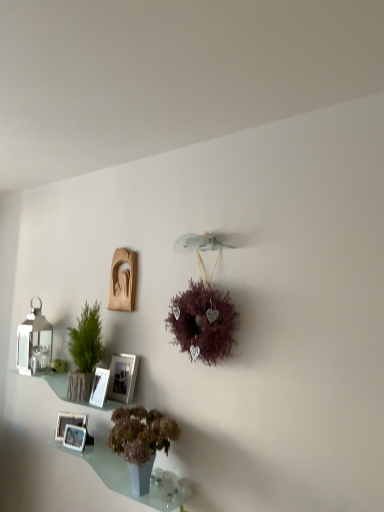
Question: Is white glossy picture frame at lower left, arranged as the 3th picture frame when ordered from the bottom, facing towards translucent glass shelf at lower center, which appears as the 2th window sill when viewed from the top?

Choices:
 (A) no
 (B) yes

Answer: (A)

Question: Does white glossy picture frame at lower left, marked as the 3th picture frame in a top-to-bottom arrangement, have a lesser height compared to translucent glass shelf at lower center, which is the 1th window sill in bottom-to-top order?

Choices:
 (A) yes
 (B) no

Answer: (B)

Question: Considering the relative sizes of white glossy picture frame at lower left, arranged as the 3th picture frame when ordered from the bottom, and translucent glass shelf at lower center, which is the 1th window sill in bottom-to-top order, in the image provided, is white glossy picture frame at lower left, arranged as the 3th picture frame when ordered from the bottom, bigger than translucent glass shelf at lower center, which is the 1th window sill in bottom-to-top order,?

Choices:
 (A) yes
 (B) no

Answer: (B)

Question: Are white glossy picture frame at lower left, marked as the 3th picture frame in a top-to-bottom arrangement, and translucent glass shelf at lower center, which is the 1th window sill in bottom-to-top order, located far from each other?

Choices:
 (A) yes
 (B) no

Answer: (B)

Question: From the image's perspective, is white glossy picture frame at lower left, marked as the 3th picture frame in a top-to-bottom arrangement, located above translucent glass shelf at lower center, which appears as the 2th window sill when viewed from the top?

Choices:
 (A) yes
 (B) no

Answer: (A)

Question: Based on their sizes in the image, would you say translucent glass shelf at lower center, which is the 1th window sill in bottom-to-top order, is bigger or smaller than matte silver picture frame at center, the 2th picture frame from the top?

Choices:
 (A) small
 (B) big

Answer: (B)

Question: From the image's perspective, is translucent glass shelf at lower center, which is the 1th window sill in bottom-to-top order, located above or below matte silver picture frame at center, the fourth picture frame ordered from the bottom?

Choices:
 (A) below
 (B) above

Answer: (A)

Question: Is translucent glass shelf at lower center, which is the 1th window sill in bottom-to-top order, wider or thinner than matte silver picture frame at center, the fourth picture frame ordered from the bottom?

Choices:
 (A) wide
 (B) thin

Answer: (A)

Question: Considering the relative positions of translucent glass shelf at lower center, which appears as the 2th window sill when viewed from the top, and matte silver picture frame at center, the 2th picture frame from the top, in the image provided, is translucent glass shelf at lower center, which appears as the 2th window sill when viewed from the top, to the left or to the right of matte silver picture frame at center, the 2th picture frame from the top,?

Choices:
 (A) right
 (B) left

Answer: (A)

Question: Considering the positions of matte glass shelf at lower left, the 1th window sill from the top, and green textured vase at left, arranged as the second houseplant when viewed from the right, in the image, is matte glass shelf at lower left, the 1th window sill from the top, taller or shorter than green textured vase at left, arranged as the second houseplant when viewed from the right,?

Choices:
 (A) short
 (B) tall

Answer: (A)

Question: Based on their positions, is matte glass shelf at lower left, which is the 2th window sill in bottom-to-top order, located to the left or right of green textured vase at left, the second houseplant viewed from the front?

Choices:
 (A) right
 (B) left

Answer: (B)

Question: Is matte glass shelf at lower left, which is the 2th window sill in bottom-to-top order, situated inside green textured vase at left, the second houseplant viewed from the front, or outside?

Choices:
 (A) outside
 (B) inside

Answer: (A)

Question: Is point (109, 409) closer or farther from the camera than point (77, 364)?

Choices:
 (A) closer
 (B) farther

Answer: (A)

Question: Does point (99, 376) appear closer or farther from the camera than point (135, 373)?

Choices:
 (A) closer
 (B) farther

Answer: (A)

Question: Considering the positions of white glossy picture frame at lower left, arranged as the 3th picture frame when ordered from the bottom, and matte silver picture frame at center, the 2th picture frame from the top, in the image, is white glossy picture frame at lower left, arranged as the 3th picture frame when ordered from the bottom, taller or shorter than matte silver picture frame at center, the 2th picture frame from the top,?

Choices:
 (A) short
 (B) tall

Answer: (A)